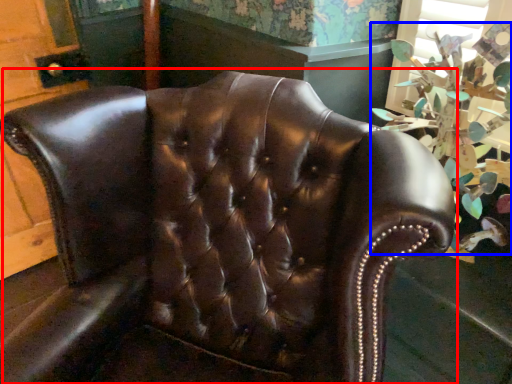
Question: Which point is further to the camera, chair (highlighted by a red box) or floral arrangement (highlighted by a blue box)?

Choices:
 (A) chair
 (B) floral arrangement

Answer: (B)